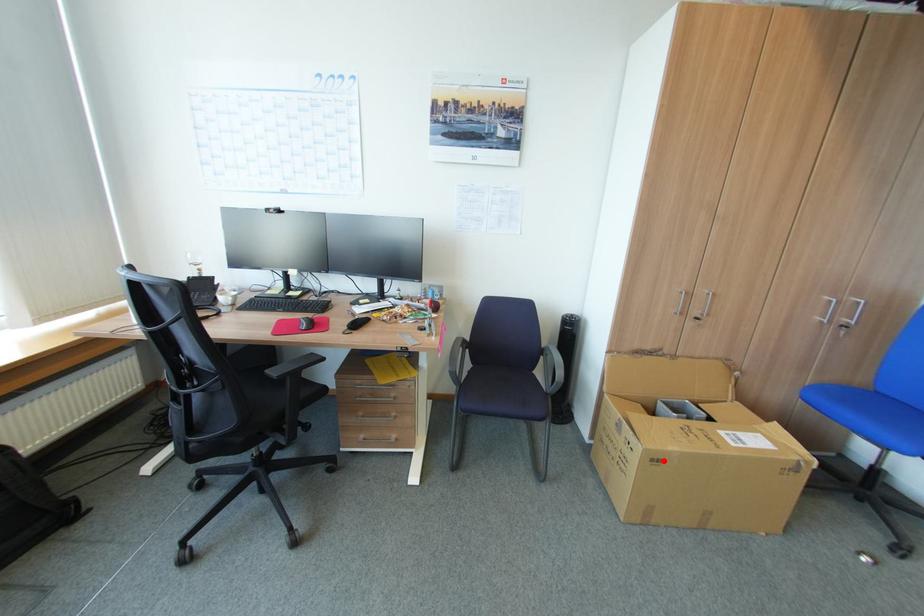
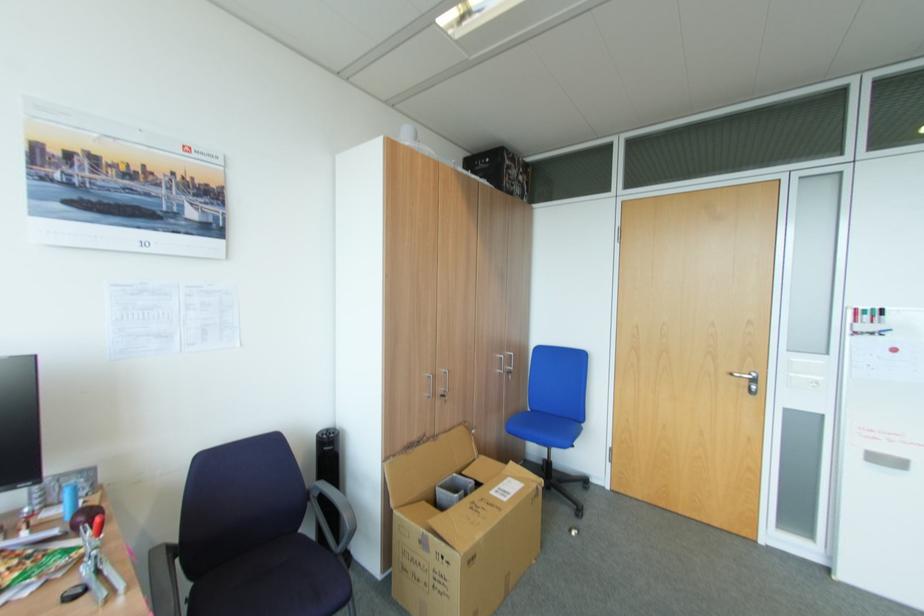
In the second image, find the point that corresponds to the highlighted location in the first image.

(479, 556)